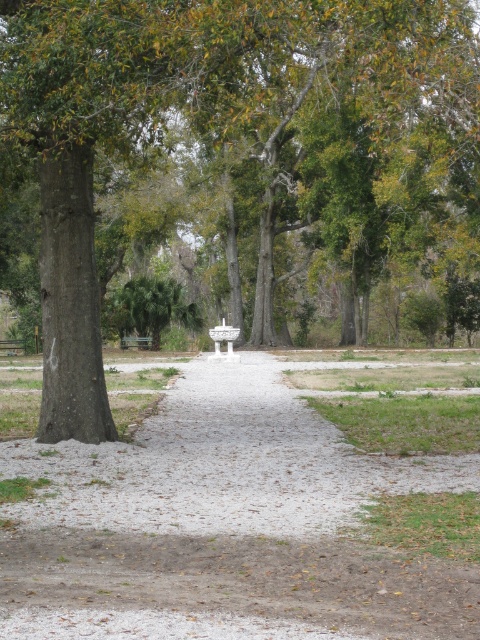
Does brown rough tree at left have a larger size compared to gray gravel path at center?

Indeed, brown rough tree at left has a larger size compared to gray gravel path at center.

Is brown rough tree at left thinner than gray gravel path at center?

Incorrect, brown rough tree at left's width is not less than gray gravel path at center's.

Between point (364, 285) and point (256, 608), which one is positioned in front?

Point (256, 608)

Where is `brown rough tree at left`? This screenshot has width=480, height=640. brown rough tree at left is located at coordinates (236, 173).

Can you confirm if gray gravel path at center is positioned to the left of wooden bench at center?

No, gray gravel path at center is not to the left of wooden bench at center.

What do you see at coordinates (223, 524) in the screenshot? This screenshot has width=480, height=640. I see `gray gravel path at center` at bounding box center [223, 524].

Find the location of a particular element. The image size is (480, 640). gray gravel path at center is located at coordinates point(223,524).

Who is more distant from viewer, (173,49) or (130,340)?

Positioned behind is point (130,340).

Can you confirm if brown rough tree at left is positioned above wooden bench at center?

Yes, brown rough tree at left is above wooden bench at center.

Between point (78, 216) and point (136, 340), which one is positioned behind?

The point (136, 340) is more distant.

I want to click on brown rough tree at left, so click(236, 173).